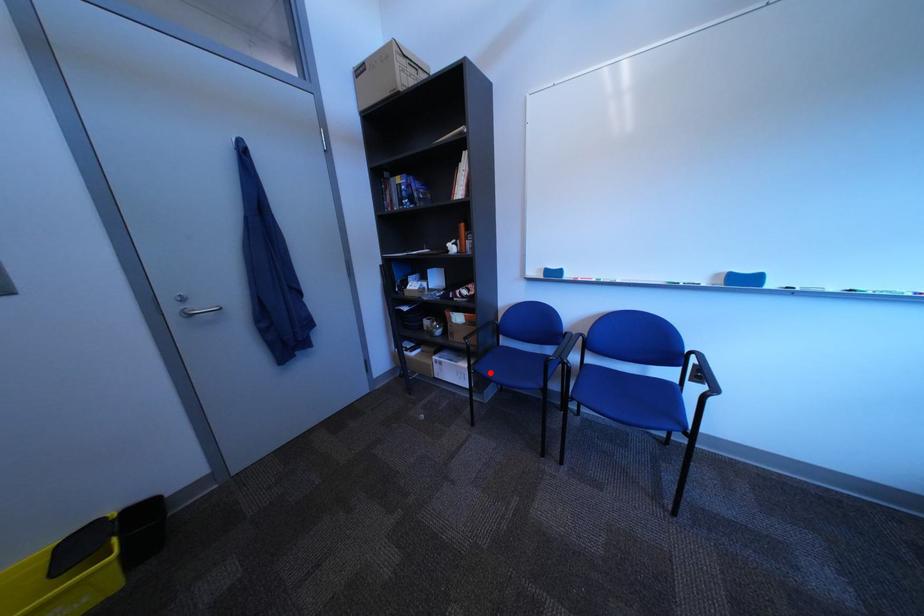
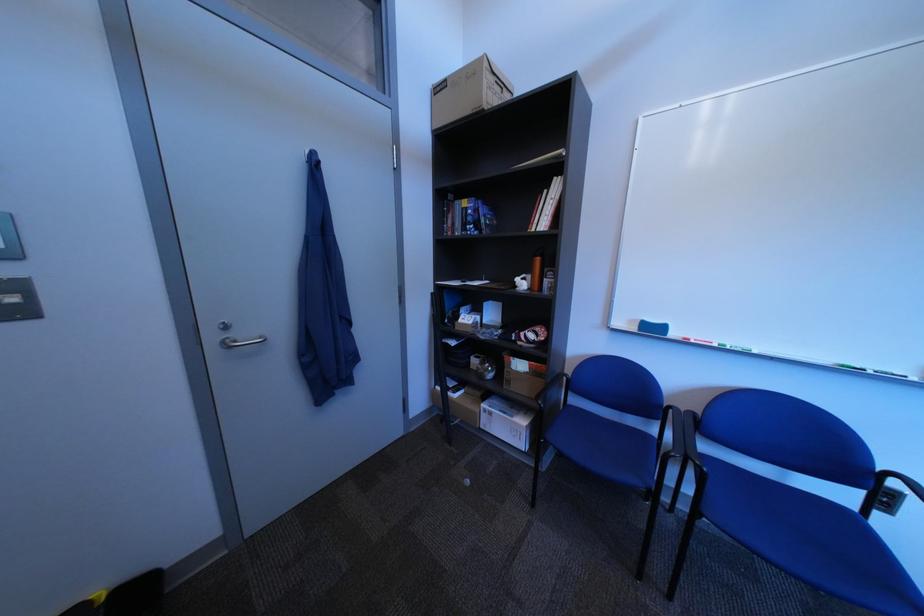
In the second image, find the point that corresponds to the highlighted location in the first image.

(561, 442)